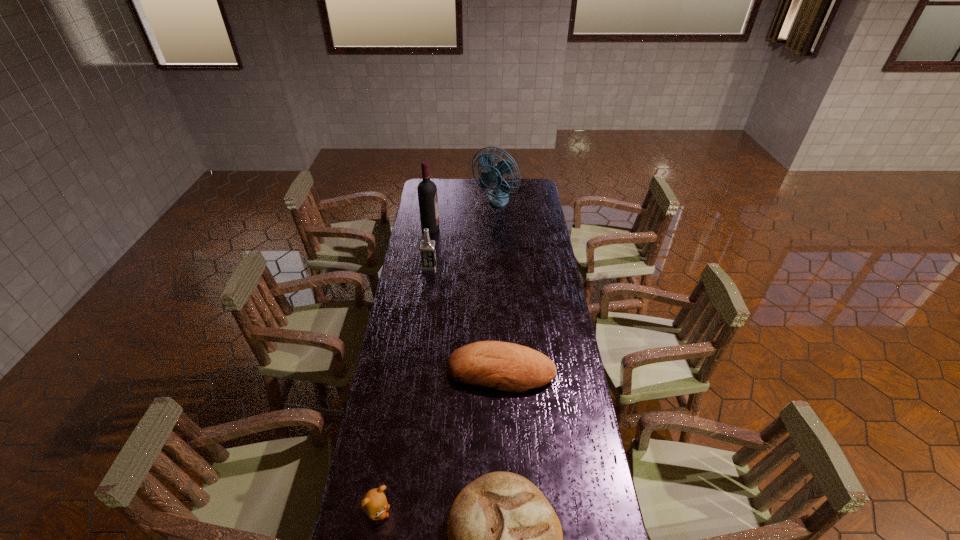
In the image, there is a desktop. Where is `vacant area at the left edge`? The image size is (960, 540). vacant area at the left edge is located at coordinates (420, 314).

The width and height of the screenshot is (960, 540). In the image, there is a desktop. In order to click on vacant space at the right edge in this screenshot , I will do `click(556, 273)`.

You are a GUI agent. You are given a task and a screenshot of the screen. Output one action in this format:
    pyautogui.click(x=<x>, y=<y>)
    Task: Click on the free point at the far left corner
    The image size is (960, 540).
    Given the screenshot: What is the action you would take?
    pyautogui.click(x=432, y=179)

I want to click on empty space between the teddy bear and the farther bread, so click(x=439, y=442).

Find the location of a particular element. This screenshot has height=540, width=960. free point between the fourth shortest object and the taller bread is located at coordinates (465, 319).

Find the location of a particular element. Image resolution: width=960 pixels, height=540 pixels. vacant area that lies between the farthest object and the teddy bear is located at coordinates (436, 357).

Locate an element on the screen. unoccupied position between the third tallest object and the third nearest object is located at coordinates (465, 319).

Find the location of a particular element. The height and width of the screenshot is (540, 960). object that is the fourth nearest to the taller bread is located at coordinates (427, 190).

This screenshot has height=540, width=960. I want to click on the closest object to the wine bottle, so click(498, 197).

I want to click on vacant space that satisfies the following two spatial constraints: 1. in front of the fan to blow air; 2. on the label of the second farthest object, so click(x=496, y=228).